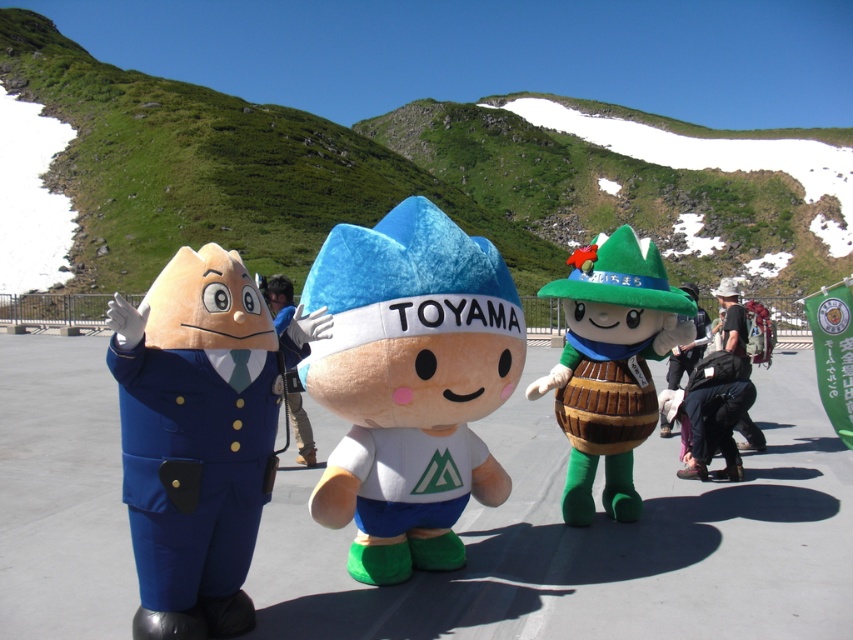
Can you confirm if dark gray backpack at center right is positioned below green felt hat at right?

Correct, dark gray backpack at center right is located below green felt hat at right.

From the picture: Can you confirm if dark gray backpack at center right is bigger than green felt hat at right?

Yes.

Between point (724, 296) and point (698, 326), which one is positioned in front?

Point (724, 296) is in front.

At what (x,y) coordinates should I click in order to perform the action: click on dark gray backpack at center right. Please return your answer as a coordinate pair (x, y). Looking at the image, I should click on (733, 323).

Who is lower down, fluffy blue plush toy at center or matte blue uniform at left?

matte blue uniform at left is below.

Locate an element on the screen. The image size is (853, 640). fluffy blue plush toy at center is located at coordinates coord(410,381).

Who is shorter, matte blue uniform at left or blue fabric toy at center?

With less height is blue fabric toy at center.

Between point (177, 404) and point (306, 436), which one is positioned behind?

Point (306, 436)

At what (x,y) coordinates should I click in order to perform the action: click on matte blue uniform at left. Please return your answer as a coordinate pair (x, y). The height and width of the screenshot is (640, 853). Looking at the image, I should click on pos(196,436).